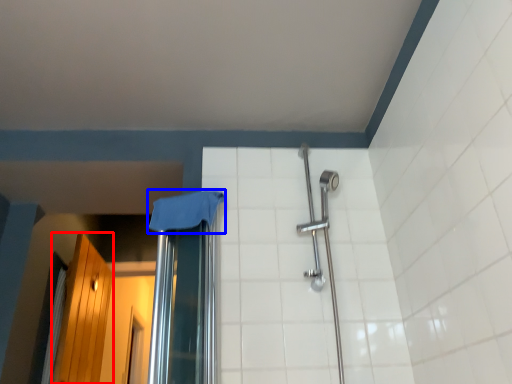
Question: Which object is further to the camera taking this photo, screen door (highlighted by a red box) or cloth (highlighted by a blue box)?

Choices:
 (A) screen door
 (B) cloth

Answer: (A)